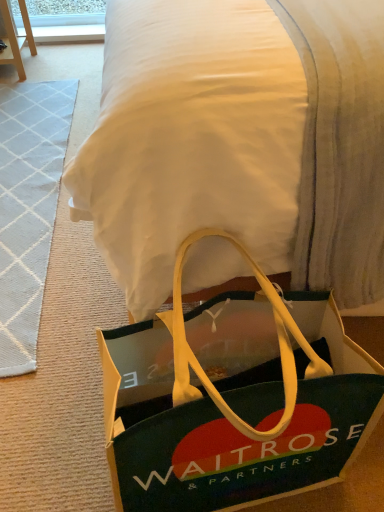
Question: Is white textured rug at left smaller than green fabric bag at lower center?

Choices:
 (A) no
 (B) yes

Answer: (B)

Question: Is white textured rug at left beside green fabric bag at lower center?

Choices:
 (A) no
 (B) yes

Answer: (A)

Question: Is white textured rug at left to the left of green fabric bag at lower center from the viewer's perspective?

Choices:
 (A) yes
 (B) no

Answer: (A)

Question: Is white textured rug at left facing away from green fabric bag at lower center?

Choices:
 (A) yes
 (B) no

Answer: (B)

Question: Is white textured rug at left oriented towards green fabric bag at lower center?

Choices:
 (A) yes
 (B) no

Answer: (B)

Question: Does point (221, 473) appear closer or farther from the camera than point (283, 13)?

Choices:
 (A) farther
 (B) closer

Answer: (B)

Question: Considering the relative positions of green fabric bag at lower center and green fabric bag at lower center in the image provided, is green fabric bag at lower center to the left or to the right of green fabric bag at lower center?

Choices:
 (A) left
 (B) right

Answer: (A)

Question: From the image's perspective, is green fabric bag at lower center above or below green fabric bag at lower center?

Choices:
 (A) above
 (B) below

Answer: (B)

Question: Is green fabric bag at lower center taller or shorter than green fabric bag at lower center?

Choices:
 (A) short
 (B) tall

Answer: (A)

Question: Is green fabric bag at lower center wider or thinner than white textured rug at left?

Choices:
 (A) thin
 (B) wide

Answer: (B)

Question: Based on their positions, is green fabric bag at lower center located to the left or right of white textured rug at left?

Choices:
 (A) left
 (B) right

Answer: (B)

Question: Considering the positions of green fabric bag at lower center and white textured rug at left in the image, is green fabric bag at lower center bigger or smaller than white textured rug at left?

Choices:
 (A) big
 (B) small

Answer: (A)

Question: Is green fabric bag at lower center inside or outside of white textured rug at left?

Choices:
 (A) inside
 (B) outside

Answer: (B)

Question: Is white textured rug at left in front of or behind green fabric bag at lower center in the image?

Choices:
 (A) front
 (B) behind

Answer: (B)

Question: Considering the positions of white textured rug at left and green fabric bag at lower center in the image, is white textured rug at left wider or thinner than green fabric bag at lower center?

Choices:
 (A) wide
 (B) thin

Answer: (B)